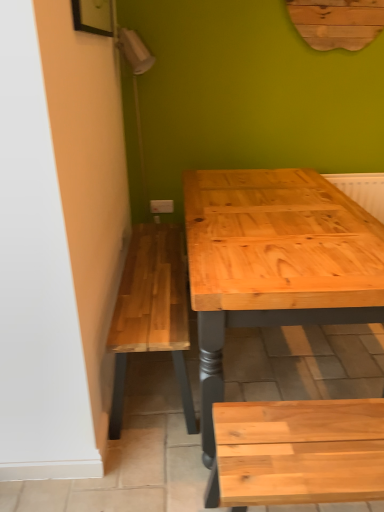
Question: Is white plastic electric outlet at center inside natural wood bench at lower right?

Choices:
 (A) no
 (B) yes

Answer: (A)

Question: Does natural wood bench at lower right have a greater width compared to white plastic electric outlet at center?

Choices:
 (A) yes
 (B) no

Answer: (A)

Question: From a real-world perspective, does natural wood bench at lower right stand above white plastic electric outlet at center?

Choices:
 (A) yes
 (B) no

Answer: (B)

Question: Does natural wood bench at lower right come in front of white plastic electric outlet at center?

Choices:
 (A) no
 (B) yes

Answer: (B)

Question: From the image's perspective, would you say natural wood bench at lower right is shown under white plastic electric outlet at center?

Choices:
 (A) no
 (B) yes

Answer: (B)

Question: Does natural wood bench at lower right have a lesser height compared to white plastic electric outlet at center?

Choices:
 (A) yes
 (B) no

Answer: (B)

Question: Would you say white plastic electric outlet at center is outside natural wood bench at lower right?

Choices:
 (A) no
 (B) yes

Answer: (B)

Question: Considering the relative positions of white plastic electric outlet at center and natural wood bench at lower right in the image provided, is white plastic electric outlet at center to the left of natural wood bench at lower right from the viewer's perspective?

Choices:
 (A) yes
 (B) no

Answer: (A)

Question: Is white plastic electric outlet at center not near natural wood bench at lower right?

Choices:
 (A) yes
 (B) no

Answer: (A)

Question: Can natural wood bench at lower right be found inside white plastic electric outlet at center?

Choices:
 (A) no
 (B) yes

Answer: (A)

Question: Is white plastic electric outlet at center facing away from natural wood bench at lower right?

Choices:
 (A) no
 (B) yes

Answer: (A)

Question: Does white plastic electric outlet at center have a greater width compared to natural wood bench at lower right?

Choices:
 (A) yes
 (B) no

Answer: (B)

Question: In terms of height, does white plastic electric outlet at center look taller or shorter compared to natural wood bench at lower right?

Choices:
 (A) tall
 (B) short

Answer: (B)